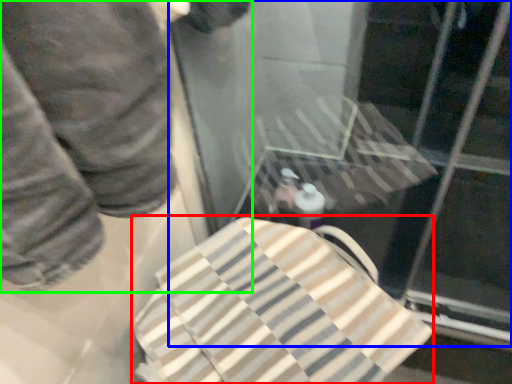
Question: Considering the real-world distances, which object is closest to beach towel (highlighted by a red box)? glass door (highlighted by a blue box) or person (highlighted by a green box).

Choices:
 (A) glass door
 (B) person

Answer: (B)